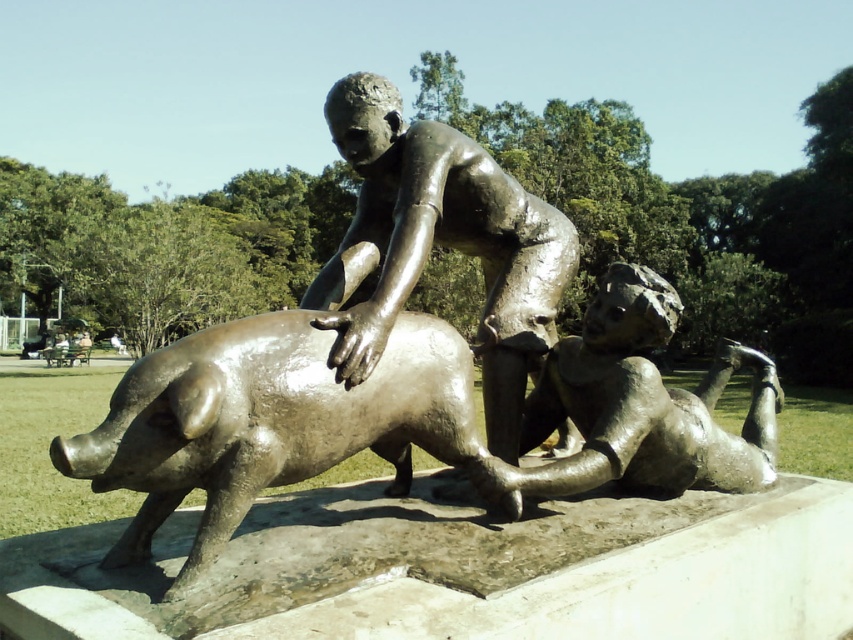
You are a photographer trying to capture the shiny bronze pig at center in your shot. The park has a rule that you must stand exactly at the point where the pig is located to take the photo. Where should you position yourself to take the photo?

The shiny bronze pig at center is located at the 2D coordinates point (265, 420), so you should position yourself at that point to take the photo.